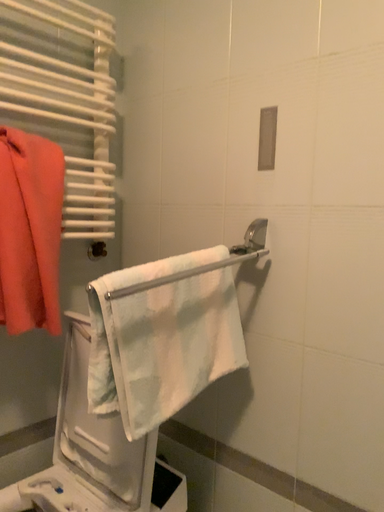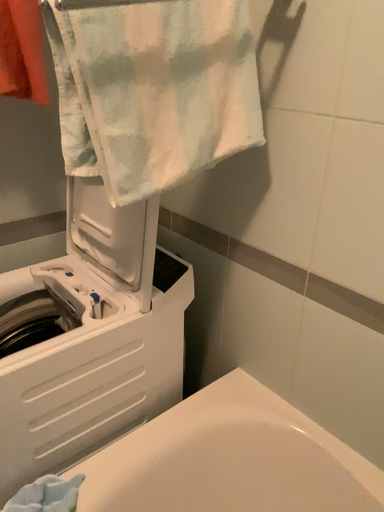
Question: Which way did the camera rotate in the video?

Choices:
 (A) rotated right
 (B) rotated left

Answer: (B)